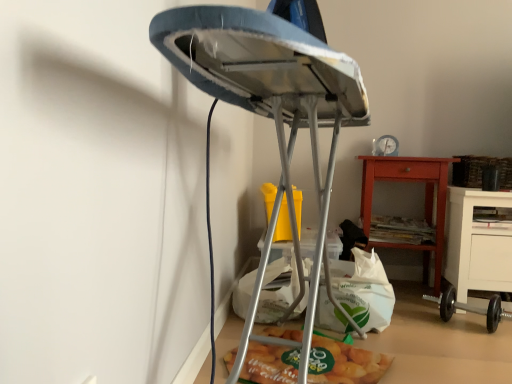
This screenshot has height=384, width=512. Identify the location of free space behind black rubber dumbbell at lower right. (438, 307).